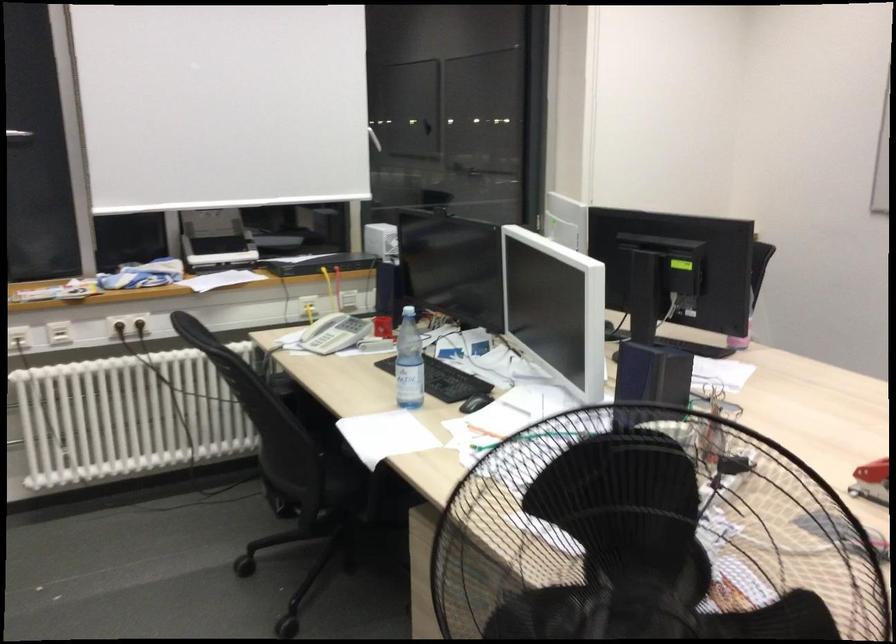
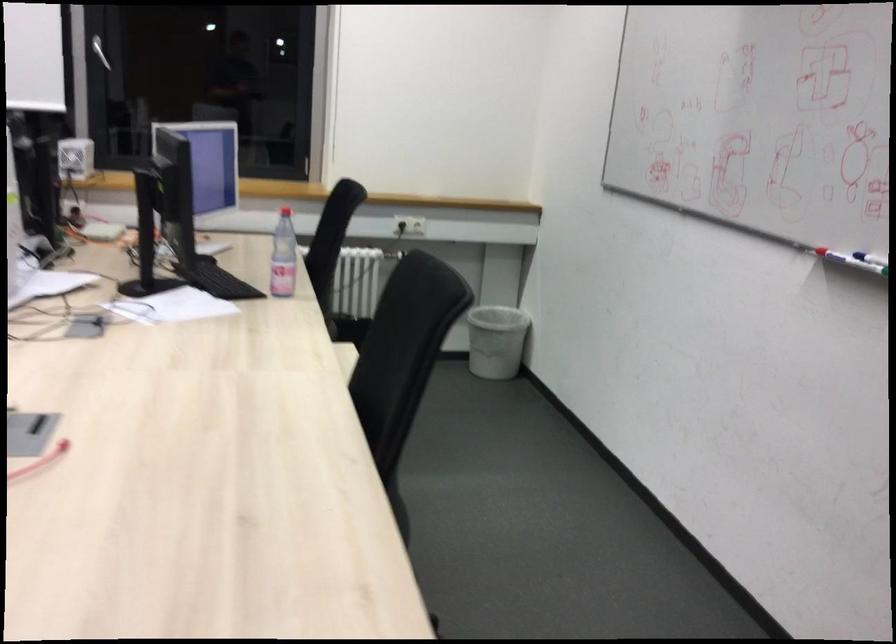
Question: The images are taken continuously from a first-person perspective. In which direction are you moving?

Choices:
 (A) Left
 (B) Right
 (C) Forward
 (D) Backward

Answer: (B)